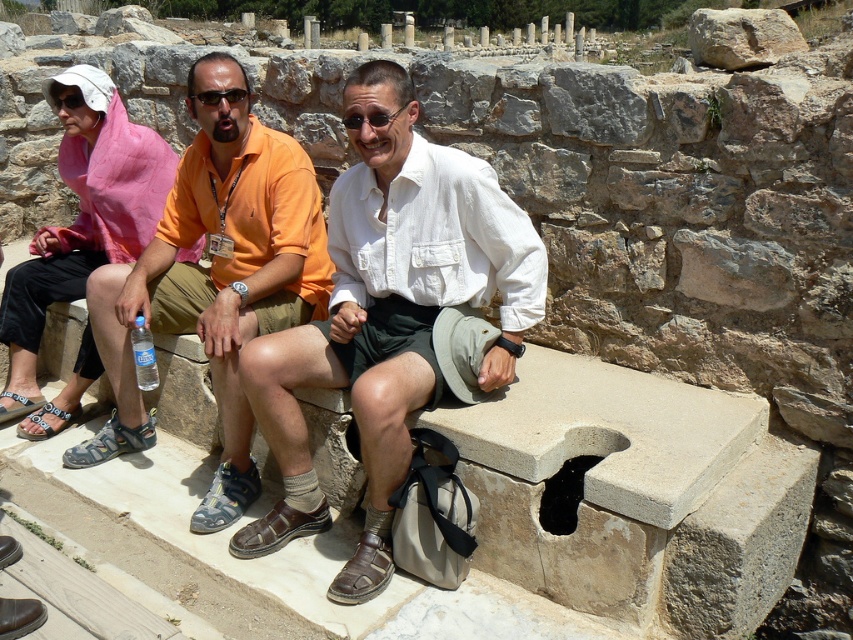
Question: Which object is the farthest from the white cotton shirt at center?

Choices:
 (A) orange cotton shirt at left
 (B) pink fabric headscarf at upper left

Answer: (B)

Question: Can you confirm if pink fabric headscarf at upper left is thinner than gray fabric sandal at lower left?

Choices:
 (A) no
 (B) yes

Answer: (A)

Question: Which object is positioned closest to the white cotton shirt at center?

Choices:
 (A) pink fabric headscarf at upper left
 (B) orange cotton shirt at left

Answer: (B)

Question: Which object is the closest to the orange cotton shirt at left?

Choices:
 (A) gray fabric sandal at lower left
 (B) pink fabric headscarf at upper left

Answer: (B)

Question: Can you confirm if white cotton shirt at center is positioned below orange cotton shirt at left?

Choices:
 (A) no
 (B) yes

Answer: (B)

Question: Can you confirm if white cotton shirt at center is bigger than orange cotton shirt at left?

Choices:
 (A) yes
 (B) no

Answer: (B)